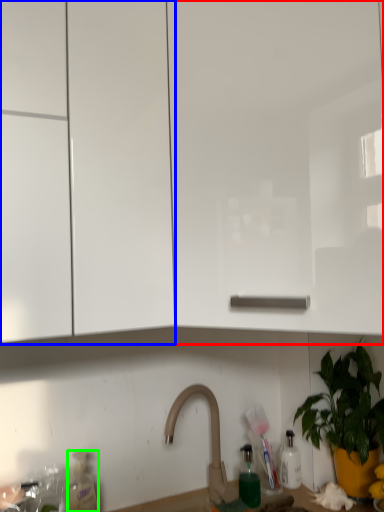
Question: Based on their relative distances, which object is farther from cabinetry (highlighted by a red box)? Choose from cabinetry (highlighted by a blue box) and bottle (highlighted by a green box).

Choices:
 (A) cabinetry
 (B) bottle

Answer: (B)